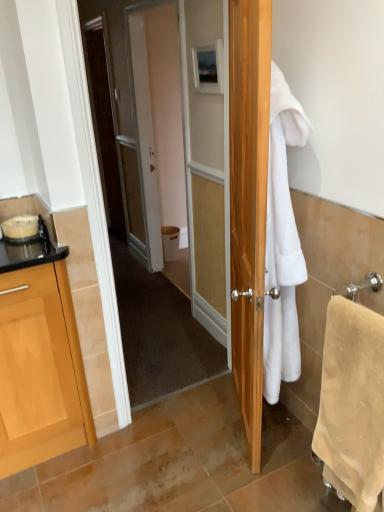
This screenshot has width=384, height=512. What do you see at coordinates (282, 242) in the screenshot?
I see `white fluffy towel at right, positioned as the 2th towel/napkin in right-to-left order` at bounding box center [282, 242].

This screenshot has width=384, height=512. What do you see at coordinates (352, 403) in the screenshot?
I see `beige soft towel at right, acting as the 1th towel/napkin starting from the right` at bounding box center [352, 403].

What is the approximate height of matte wooden picture frame at upper center?

matte wooden picture frame at upper center is 9.66 inches tall.

Identify the location of white fluffy towel at right, positioned as the 2th towel/napkin in right-to-left order. (282, 242).

Which is more to the left, beige soft towel at right, acting as the 1th towel/napkin starting from the right, or matte wooden picture frame at upper center?

Positioned to the left is matte wooden picture frame at upper center.

Does beige soft towel at right, which is the 2th towel/napkin in left-to-right order, turn towards matte wooden picture frame at upper center?

No.

Who is bigger, beige soft towel at right, which is the 2th towel/napkin in left-to-right order, or matte wooden picture frame at upper center?

beige soft towel at right, which is the 2th towel/napkin in left-to-right order.

Which is correct: beige soft towel at right, acting as the 1th towel/napkin starting from the right, is inside matte wooden picture frame at upper center, or outside of it?

The correct answer is: outside.

Is matte wooden picture frame at upper center looking in the opposite direction of white plastic trash bin at center?

matte wooden picture frame at upper center is not turned away from white plastic trash bin at center.

Considering the relative sizes of matte wooden picture frame at upper center and white plastic trash bin at center in the image provided, is matte wooden picture frame at upper center bigger than white plastic trash bin at center?

No, matte wooden picture frame at upper center is not bigger than white plastic trash bin at center.

Consider the image. Which is more to the left, matte wooden picture frame at upper center or white plastic trash bin at center?

white plastic trash bin at center.

Can you confirm if beige soft towel at right, which is the 2th towel/napkin in left-to-right order, is shorter than white plastic trash bin at center?

In fact, beige soft towel at right, which is the 2th towel/napkin in left-to-right order, may be taller than white plastic trash bin at center.

Is beige soft towel at right, acting as the 1th towel/napkin starting from the right, oriented away from white plastic trash bin at center?

No, beige soft towel at right, acting as the 1th towel/napkin starting from the right,'s orientation is not away from white plastic trash bin at center.

Which of these two, beige soft towel at right, which is the 2th towel/napkin in left-to-right order, or white plastic trash bin at center, is smaller?

white plastic trash bin at center is smaller.

Is there a large distance between beige soft towel at right, which is the 2th towel/napkin in left-to-right order, and white plastic trash bin at center?

beige soft towel at right, which is the 2th towel/napkin in left-to-right order, is positioned a significant distance from white plastic trash bin at center.

Is white fluffy towel at right, which is the 1th towel/napkin from left to right, touching matte wooden picture frame at upper center?

white fluffy towel at right, which is the 1th towel/napkin from left to right, and matte wooden picture frame at upper center are not in contact.

From the image's perspective, is white fluffy towel at right, which is the 1th towel/napkin from left to right, under matte wooden picture frame at upper center?

Correct, white fluffy towel at right, which is the 1th towel/napkin from left to right, appears lower than matte wooden picture frame at upper center in the image.

From a real-world perspective, relative to matte wooden picture frame at upper center, is white fluffy towel at right, which is the 1th towel/napkin from left to right, vertically above or below?

From a real-world perspective, white fluffy towel at right, which is the 1th towel/napkin from left to right, is physically below matte wooden picture frame at upper center.

Who is shorter, white fluffy towel at right, which is the 1th towel/napkin from left to right, or matte wooden picture frame at upper center?

matte wooden picture frame at upper center is shorter.

Is matte wooden picture frame at upper center positioned in front of white fluffy towel at right, positioned as the 2th towel/napkin in right-to-left order?

That is False.

Considering the points (198, 75) and (292, 113), which point is behind, point (198, 75) or point (292, 113)?

Positioned behind is point (198, 75).

Is white fluffy towel at right, positioned as the 2th towel/napkin in right-to-left order, located within matte wooden picture frame at upper center?

No, white fluffy towel at right, positioned as the 2th towel/napkin in right-to-left order, is not inside matte wooden picture frame at upper center.

From a real-world perspective, who is located lower, matte wooden picture frame at upper center or white fluffy towel at right, which is the 1th towel/napkin from left to right?

white fluffy towel at right, which is the 1th towel/napkin from left to right.

Looking at this image, which of these two, white fluffy towel at right, positioned as the 2th towel/napkin in right-to-left order, or white plastic trash bin at center, stands taller?

white fluffy towel at right, positioned as the 2th towel/napkin in right-to-left order.

From the image's perspective, is white fluffy towel at right, which is the 1th towel/napkin from left to right, on top of white plastic trash bin at center?

Incorrect, from the image's perspective, white fluffy towel at right, which is the 1th towel/napkin from left to right, is lower than white plastic trash bin at center.

From a real-world perspective, between white fluffy towel at right, positioned as the 2th towel/napkin in right-to-left order, and white plastic trash bin at center, who is vertically lower?

From a 3D spatial view, white plastic trash bin at center is below.

The width and height of the screenshot is (384, 512). Identify the location of trash bin/can located on the left of white fluffy towel at right, which is the 1th towel/napkin from left to right. click(170, 242).

How far apart are beige soft towel at right, acting as the 1th towel/napkin starting from the right, and white fluffy towel at right, which is the 1th towel/napkin from left to right?

The distance of beige soft towel at right, acting as the 1th towel/napkin starting from the right, from white fluffy towel at right, which is the 1th towel/napkin from left to right, is 38.71 centimeters.

Is beige soft towel at right, which is the 2th towel/napkin in left-to-right order, completely or partially outside of white fluffy towel at right, which is the 1th towel/napkin from left to right?

Yes, beige soft towel at right, which is the 2th towel/napkin in left-to-right order, is outside of white fluffy towel at right, which is the 1th towel/napkin from left to right.

Looking at their sizes, would you say beige soft towel at right, acting as the 1th towel/napkin starting from the right, is wider or thinner than white fluffy towel at right, positioned as the 2th towel/napkin in right-to-left order?

Clearly, beige soft towel at right, acting as the 1th towel/napkin starting from the right, has less width compared to white fluffy towel at right, positioned as the 2th towel/napkin in right-to-left order.

From a real-world perspective, which is physically below, beige soft towel at right, which is the 2th towel/napkin in left-to-right order, or white fluffy towel at right, positioned as the 2th towel/napkin in right-to-left order?

beige soft towel at right, which is the 2th towel/napkin in left-to-right order, from a real-world perspective.

At what (x,y) coordinates should I click in order to perform the action: click on picture frame that is on the left side of beige soft towel at right, acting as the 1th towel/napkin starting from the right. Please return your answer as a coordinate pair (x, y). This screenshot has height=512, width=384. Looking at the image, I should click on (208, 67).

The height and width of the screenshot is (512, 384). In order to click on trash bin/can below the matte wooden picture frame at upper center (from the image's perspective) in this screenshot , I will do `click(170, 242)`.

Considering their positions, is beige soft towel at right, acting as the 1th towel/napkin starting from the right, positioned closer to white fluffy towel at right, which is the 1th towel/napkin from left to right, than matte wooden picture frame at upper center?

beige soft towel at right, acting as the 1th towel/napkin starting from the right.

Based on their spatial positions, is beige soft towel at right, acting as the 1th towel/napkin starting from the right, or matte wooden picture frame at upper center closer to white plastic trash bin at center?

matte wooden picture frame at upper center is positioned closer to the anchor white plastic trash bin at center.

From the image, which object appears to be nearer to matte wooden picture frame at upper center, white plastic trash bin at center or white fluffy towel at right, which is the 1th towel/napkin from left to right?

white fluffy towel at right, which is the 1th towel/napkin from left to right, lies closer to matte wooden picture frame at upper center than the other object.

Looking at the image, which one is located further to white plastic trash bin at center, white fluffy towel at right, which is the 1th towel/napkin from left to right, or matte wooden picture frame at upper center?

white fluffy towel at right, which is the 1th towel/napkin from left to right.

Which object lies nearer to the anchor point white fluffy towel at right, positioned as the 2th towel/napkin in right-to-left order, matte wooden picture frame at upper center or beige soft towel at right, acting as the 1th towel/napkin starting from the right?

beige soft towel at right, acting as the 1th towel/napkin starting from the right, is positioned closer to the anchor white fluffy towel at right, positioned as the 2th towel/napkin in right-to-left order.

When comparing their distances from white plastic trash bin at center, does white fluffy towel at right, which is the 1th towel/napkin from left to right, or beige soft towel at right, which is the 2th towel/napkin in left-to-right order, seem closer?

white fluffy towel at right, which is the 1th towel/napkin from left to right, is closer to white plastic trash bin at center.

From the image, which object appears to be farther from white plastic trash bin at center, matte wooden picture frame at upper center or beige soft towel at right, acting as the 1th towel/napkin starting from the right?

The object further to white plastic trash bin at center is beige soft towel at right, acting as the 1th towel/napkin starting from the right.

Looking at the image, which one is located further to beige soft towel at right, which is the 2th towel/napkin in left-to-right order, white fluffy towel at right, which is the 1th towel/napkin from left to right, or white plastic trash bin at center?

Among the two, white plastic trash bin at center is located further to beige soft towel at right, which is the 2th towel/napkin in left-to-right order.

At what (x,y) coordinates should I click in order to perform the action: click on towel/napkin between matte wooden picture frame at upper center and beige soft towel at right, which is the 2th towel/napkin in left-to-right order, in the up-down direction. Please return your answer as a coordinate pair (x, y). Looking at the image, I should click on (282, 242).

Locate an element on the screen. The width and height of the screenshot is (384, 512). picture frame located between white fluffy towel at right, positioned as the 2th towel/napkin in right-to-left order, and white plastic trash bin at center in the depth direction is located at coordinates (208, 67).

Where is `picture frame between beige soft towel at right, acting as the 1th towel/napkin starting from the right, and white plastic trash bin at center in the front-back direction`? picture frame between beige soft towel at right, acting as the 1th towel/napkin starting from the right, and white plastic trash bin at center in the front-back direction is located at coordinates (208, 67).

Locate an element on the screen. This screenshot has height=512, width=384. towel/napkin located between beige soft towel at right, which is the 2th towel/napkin in left-to-right order, and white plastic trash bin at center in the depth direction is located at coordinates (282, 242).